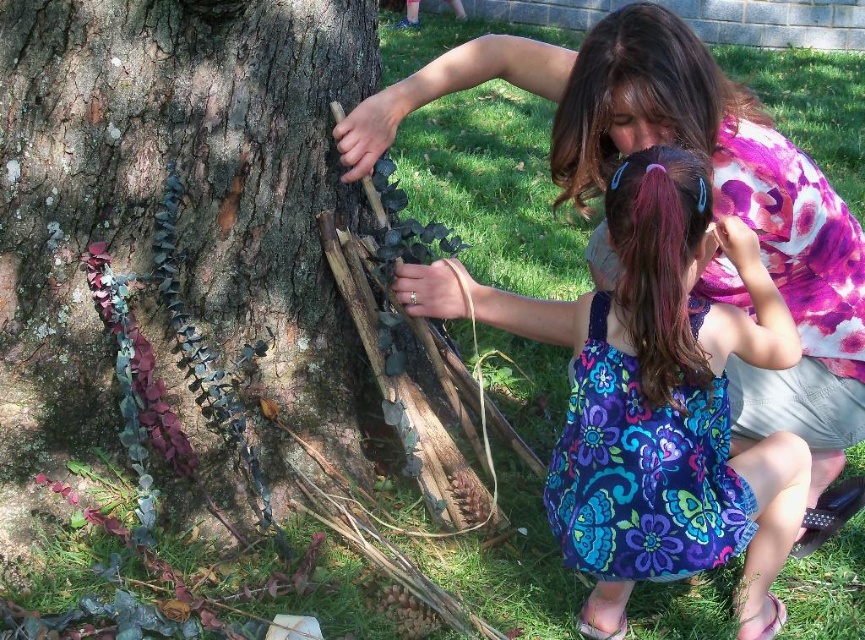
You are a photographer trying to capture a closeup of the floral dress at center. However, the green mossy bark at left is blocking your view. Can you estimate whether the mossy bark is larger than the dress, making it harder to move out of the way?

The green mossy bark at left is bigger than the floral dress at center, so it would be harder to move out of the way due to its larger size.

You are planning to place a small decorative item between the green mossy bark at left and the floral dress at center. Which object should you place it closer to if you want it to be near the narrower one?

The green mossy bark at left is thinner than the floral dress at center, so you should place the item closer to the green mossy bark at left to be near the narrower one.

Based on the photo, you are standing near the tree and want to place a small decoration between the green mossy bark at left and the floral dress at center. Based on their positions, where should you place it?

The green mossy bark at left is above the floral dress at center, so you should place the decoration between them either below the green mossy bark at left or above the floral dress at center to ensure it is in between both objects.